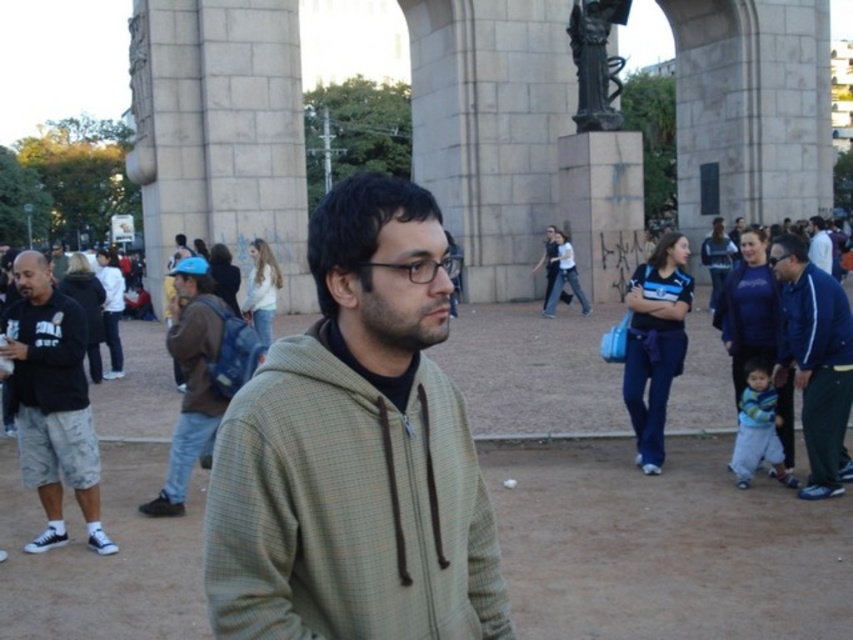
Is point (354, 193) positioned after point (831, 445)?

No, (354, 193) is in front of (831, 445).

Based on the photo, which of these two, light brown hooded sweatshirt at center or blue jacket at right, stands shorter?

Standing shorter between the two is blue jacket at right.

This screenshot has height=640, width=853. I want to click on light brown hooded sweatshirt at center, so click(x=355, y=452).

Can you confirm if light brown hooded sweatshirt at center is positioned above dark gray cotton shorts at left?

No, light brown hooded sweatshirt at center is not above dark gray cotton shorts at left.

From the picture: Is light brown hooded sweatshirt at center smaller than dark gray cotton shorts at left?

Indeed, light brown hooded sweatshirt at center has a smaller size compared to dark gray cotton shorts at left.

Locate an element on the screen. This screenshot has width=853, height=640. light brown hooded sweatshirt at center is located at coordinates (355, 452).

Does point (830, 272) come closer to viewer compared to point (769, 259)?

No, (830, 272) is behind (769, 259).

Does white fabric jacket at center have a larger size compared to matte black glasses at center?

Yes, white fabric jacket at center is bigger than matte black glasses at center.

I want to click on white fabric jacket at center, so click(820, 244).

Find the location of `white fabric jacket at center`. white fabric jacket at center is located at coordinates (820, 244).